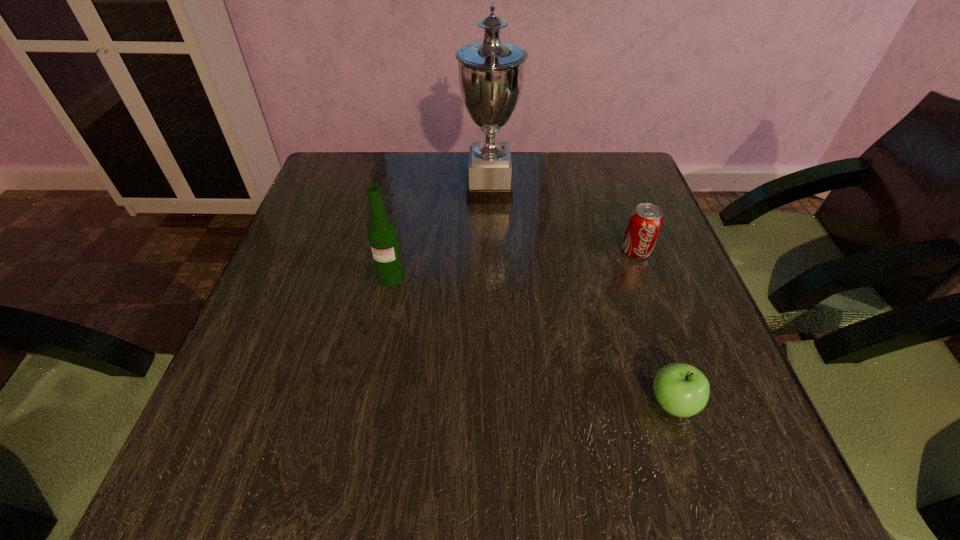
This screenshot has height=540, width=960. I want to click on free point at the near left corner, so click(292, 470).

In the image, there is a desktop. In order to click on vacant space at the far right corner in this screenshot , I will do `click(602, 178)`.

Locate an element on the screen. Image resolution: width=960 pixels, height=540 pixels. free space that is in between the second object from left to right and the soda is located at coordinates (563, 220).

I want to click on free spot between the beer bottle and the nearest object, so coord(532,340).

This screenshot has height=540, width=960. I want to click on free space between the beer bottle and the trophy cup, so click(x=441, y=234).

This screenshot has height=540, width=960. What are the coordinates of `free space between the second shortest object and the tallest object` in the screenshot? It's located at coord(563,220).

The height and width of the screenshot is (540, 960). Identify the location of unoccupied position between the leftmost object and the shortest object. coord(532,340).

This screenshot has width=960, height=540. What are the coordinates of `vacant space that's between the tallest object and the third nearest object` in the screenshot? It's located at (563, 220).

This screenshot has height=540, width=960. Find the location of `free space between the shortest object and the third nearest object`. free space between the shortest object and the third nearest object is located at coordinates (654, 327).

Locate an element on the screen. free spot between the tallest object and the second farthest object is located at coordinates click(563, 220).